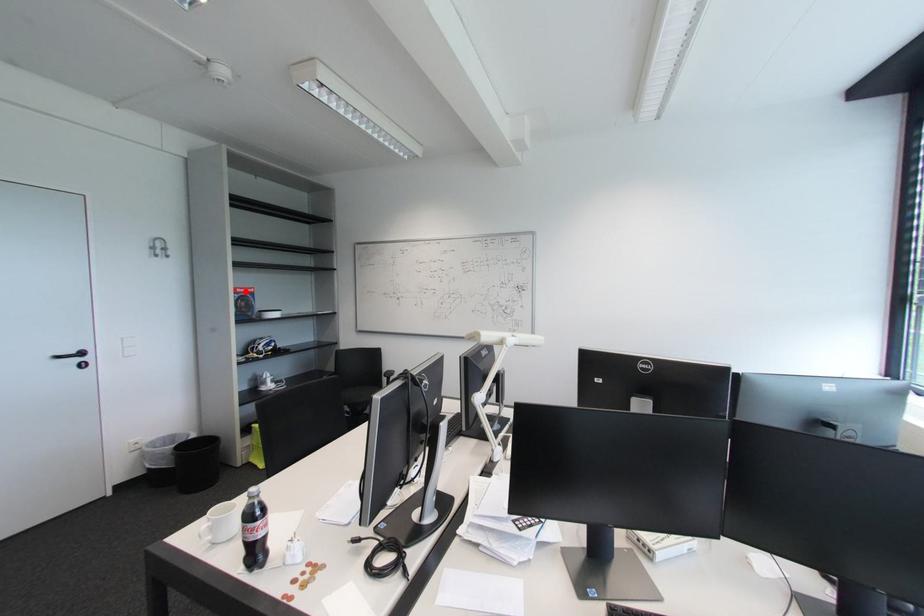
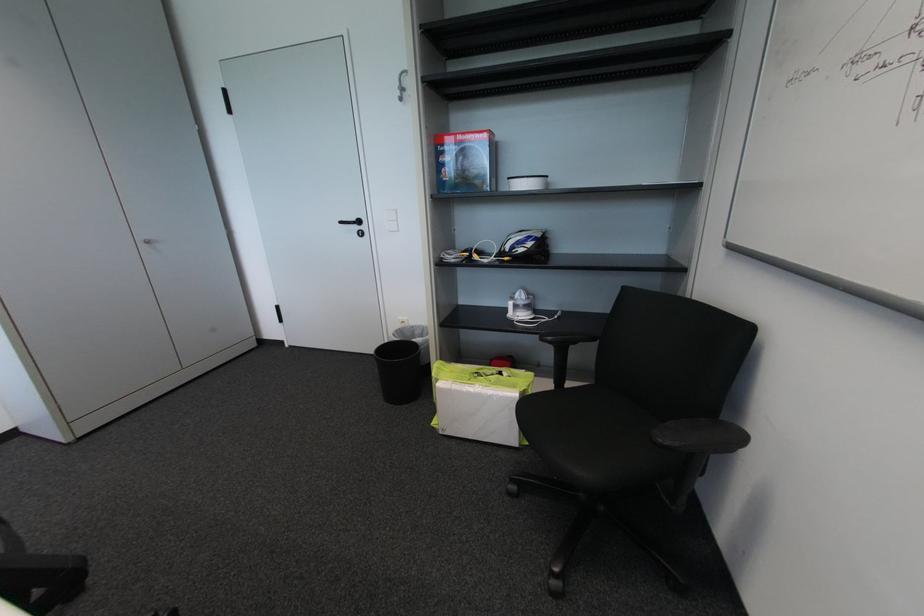
The point at the highlighted location is marked in the first image. Where is the corresponding point in the second image?

(466, 139)